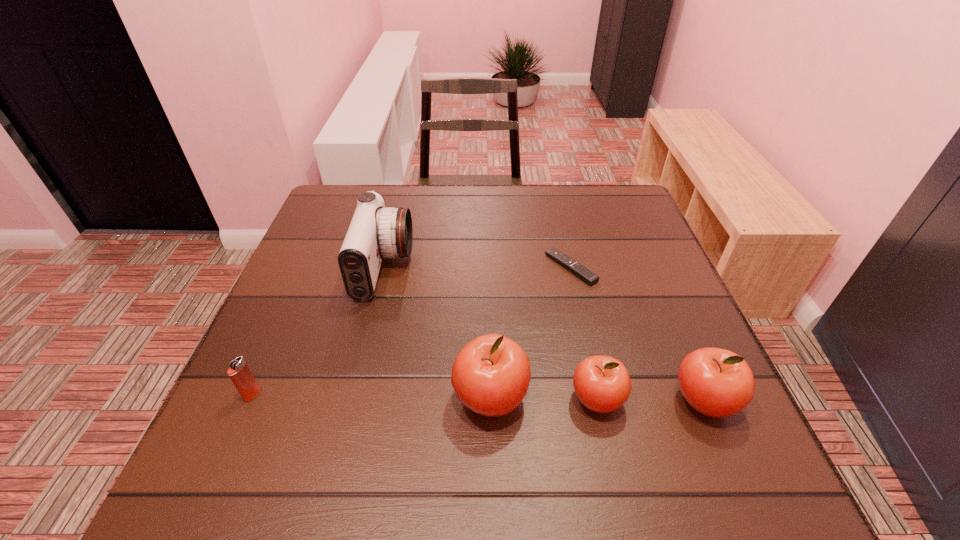
Identify the location of the third object from left to right. (491, 374).

This screenshot has height=540, width=960. Identify the location of the shortest apple. (602, 384).

Where is `the second apple from right to left`? the second apple from right to left is located at coordinates (602, 384).

Find the location of a particular element. The width and height of the screenshot is (960, 540). the rightmost object is located at coordinates (716, 382).

The width and height of the screenshot is (960, 540). I want to click on the rightmost apple, so click(716, 382).

Where is `camcorder`? camcorder is located at coordinates (376, 231).

In order to click on the leftmost object in this screenshot , I will do `click(239, 372)`.

At what (x,y) coordinates should I click in order to perform the action: click on igniter. Please return your answer as a coordinate pair (x, y). Image resolution: width=960 pixels, height=540 pixels. Looking at the image, I should click on (239, 372).

Find the location of `remote control`. remote control is located at coordinates (580, 271).

Identify the location of free space located 0.330m on the right of the third object from left to right. The width and height of the screenshot is (960, 540). (708, 398).